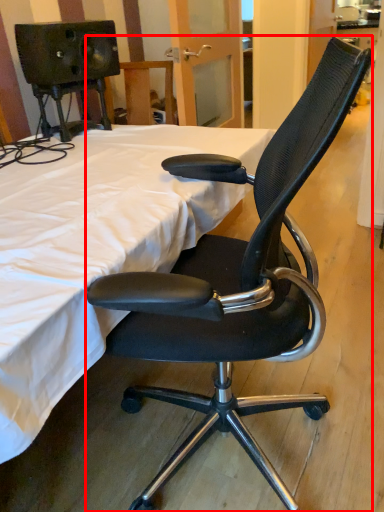
Question: From the image's perspective, considering the relative positions of chair (annotated by the red box) and bed in the image provided, where is chair (annotated by the red box) located with respect to the staircase?

Choices:
 (A) above
 (B) below

Answer: (B)